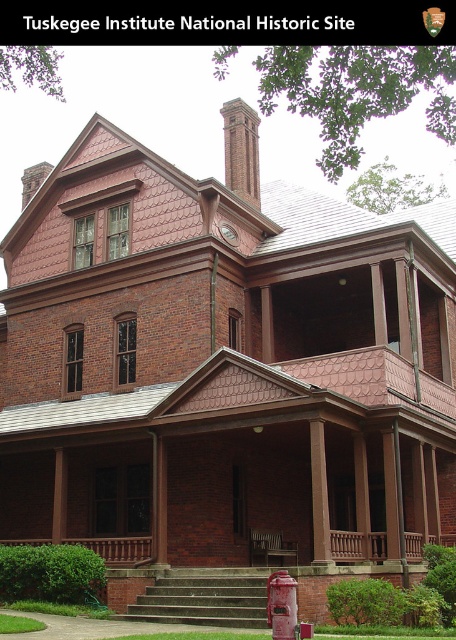
Measure the distance from rustic metal fire hydrant at lower center to metallic red phone box at lower center.

rustic metal fire hydrant at lower center and metallic red phone box at lower center are 20.18 inches apart from each other.

Can you confirm if rustic metal fire hydrant at lower center is positioned above metallic red phone box at lower center?

Indeed, rustic metal fire hydrant at lower center is positioned over metallic red phone box at lower center.

This screenshot has height=640, width=456. In order to click on rustic metal fire hydrant at lower center in this screenshot , I will do `click(281, 604)`.

This screenshot has height=640, width=456. Identify the location of rustic metal fire hydrant at lower center. (281, 604).

Is rustic metal fire hydrant at lower center shorter than metallic silver bench at center?

Yes, rustic metal fire hydrant at lower center is shorter than metallic silver bench at center.

Who is more distant from viewer, (295, 595) or (253, 529)?

Point (253, 529)

You are a GUI agent. You are given a task and a screenshot of the screen. Output one action in this format:
    pyautogui.click(x=<x>, y=<y>)
    Task: Click on the rustic metal fire hydrant at lower center
    
    Given the screenshot: What is the action you would take?
    pyautogui.click(x=281, y=604)

Which of these two, brown wood porch at lower center or rustic metal fire hydrant at lower center, stands shorter?

With less height is rustic metal fire hydrant at lower center.

The height and width of the screenshot is (640, 456). Describe the element at coordinates (357, 547) in the screenshot. I see `brown wood porch at lower center` at that location.

Find the location of `brown wood porch at lower center`. brown wood porch at lower center is located at coordinates (357, 547).